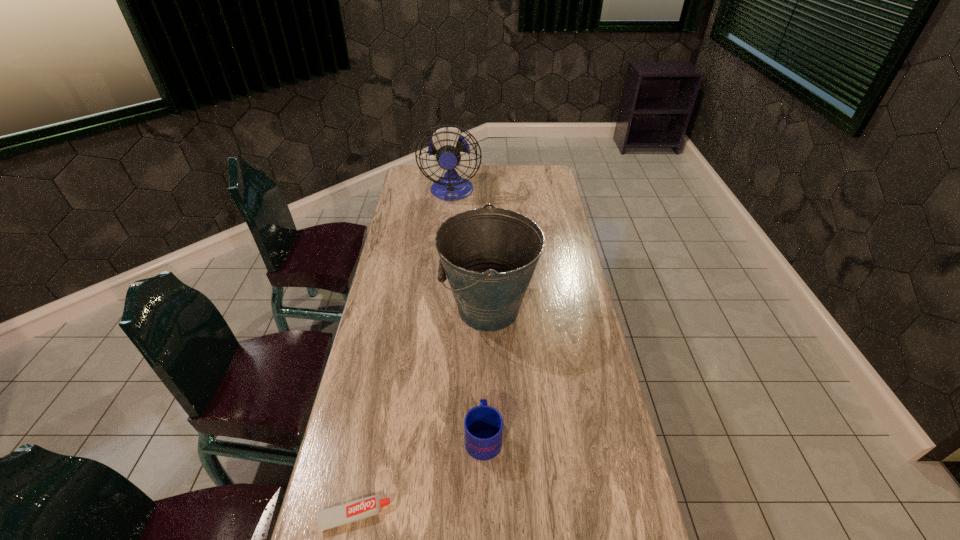
What are the coordinates of `vacant area located 0.050m on the side with the handle of the second nearest object` in the screenshot? It's located at (483, 397).

Find the location of a particular element. This screenshot has width=960, height=540. free spot located on the side with the handle of the second nearest object is located at coordinates (483, 345).

You are a GUI agent. You are given a task and a screenshot of the screen. Output one action in this format:
    pyautogui.click(x=<x>, y=<y>)
    Task: Click on the free space located 0.260m on the side with the handle of the second nearest object
    Image resolution: width=960 pixels, height=540 pixels.
    Given the screenshot: What is the action you would take?
    pyautogui.click(x=483, y=340)

The image size is (960, 540). In order to click on vacant region located on the back of the toothpaste in this screenshot , I will do `click(384, 368)`.

Where is `object situated at the far edge`? object situated at the far edge is located at coordinates (449, 154).

Locate an element on the screen. This screenshot has height=540, width=960. fan that is at the left edge is located at coordinates (449, 154).

At what (x,y) coordinates should I click in order to perform the action: click on toothpaste at the left edge. Please return your answer as a coordinate pair (x, y). Looking at the image, I should click on (356, 510).

Locate an element on the screen. object at the far left corner is located at coordinates (449, 154).

Locate an element on the screen. This screenshot has height=540, width=960. free point at the far edge is located at coordinates (498, 171).

Locate an element on the screen. vacant space at the left edge of the desktop is located at coordinates 351,489.